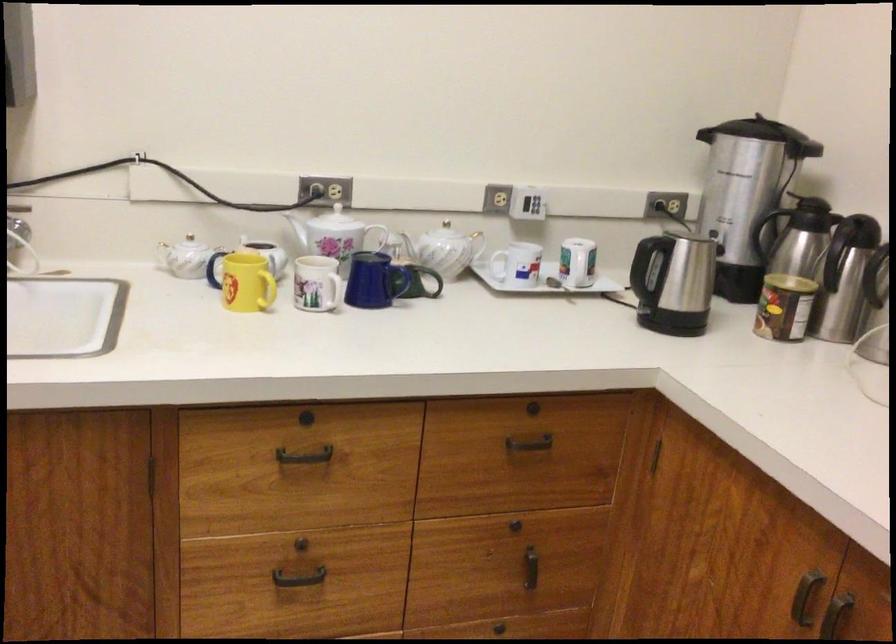
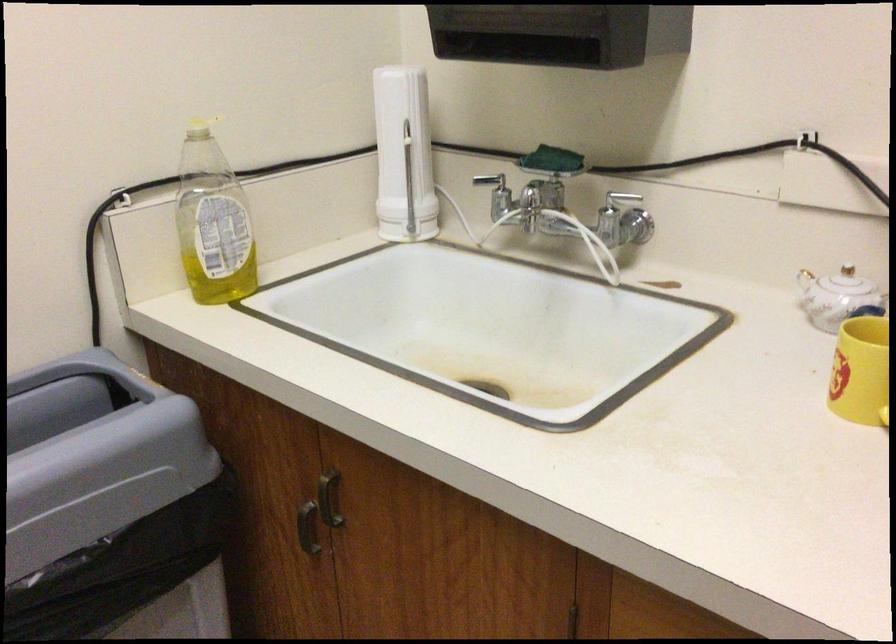
In the second image, find the point that corresponds to point (259, 308) in the first image.

(877, 417)